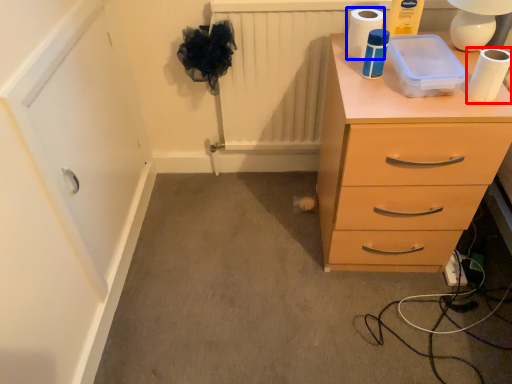
Question: Which object appears closest to the camera in this image, toilet paper (highlighted by a red box) or toilet paper (highlighted by a blue box)?

Choices:
 (A) toilet paper
 (B) toilet paper

Answer: (A)